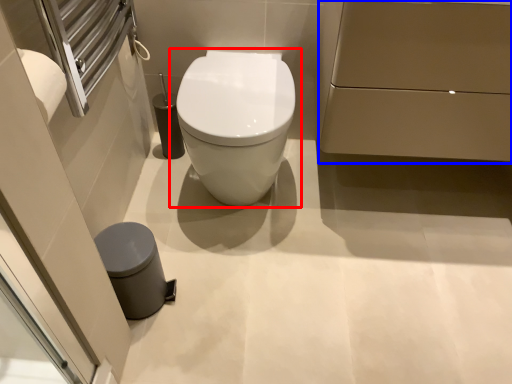
Question: Which object appears farthest to the camera in this image, toilet (highlighted by a red box) or porcelain (highlighted by a blue box)?

Choices:
 (A) toilet
 (B) porcelain

Answer: (A)